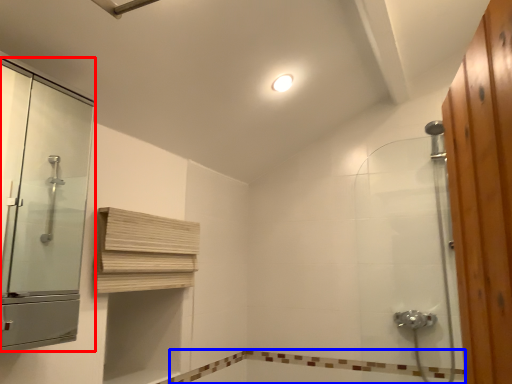
Question: Which object appears closest to the camera in this image, screen door (highlighted by a red box) or bath (highlighted by a blue box)?

Choices:
 (A) screen door
 (B) bath

Answer: (A)